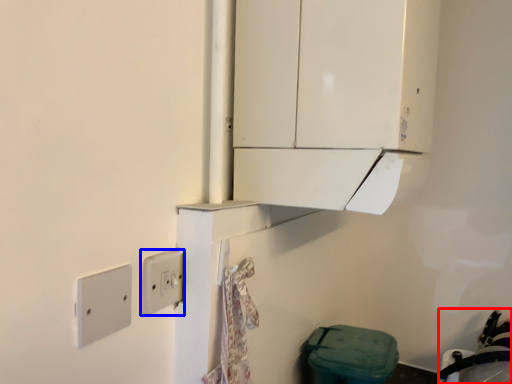
Question: Which object is closer to the camera taking this photo, sink (highlighted by a red box) or light switch (highlighted by a blue box)?

Choices:
 (A) sink
 (B) light switch

Answer: (B)